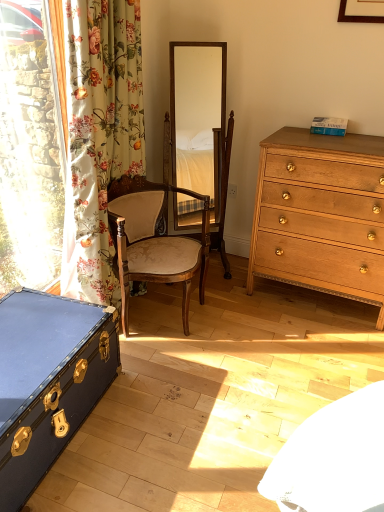
Question: Does wooden mirror at center appear on the right side of wooden chair at center?

Choices:
 (A) no
 (B) yes

Answer: (B)

Question: Does wooden mirror at center have a smaller size compared to wooden chair at center?

Choices:
 (A) no
 (B) yes

Answer: (B)

Question: Does wooden mirror at center come behind wooden chair at center?

Choices:
 (A) no
 (B) yes

Answer: (B)

Question: From the image's perspective, is wooden mirror at center located above wooden chair at center?

Choices:
 (A) no
 (B) yes

Answer: (B)

Question: Can you confirm if wooden mirror at center is positioned to the left of wooden chair at center?

Choices:
 (A) yes
 (B) no

Answer: (B)

Question: From the image's perspective, is light brown wood chest of drawers at right above or below wooden chair at center?

Choices:
 (A) below
 (B) above

Answer: (B)

Question: Does point (364, 250) appear closer or farther from the camera than point (206, 254)?

Choices:
 (A) farther
 (B) closer

Answer: (B)

Question: From a real-world perspective, relative to wooden chair at center, is light brown wood chest of drawers at right vertically above or below?

Choices:
 (A) below
 (B) above

Answer: (B)

Question: Would you say light brown wood chest of drawers at right is to the left or to the right of wooden chair at center in the picture?

Choices:
 (A) right
 (B) left

Answer: (A)

Question: Considering the relative positions of white plastic power outlet at center and blue leather trunk at lower left in the image provided, is white plastic power outlet at center to the left or to the right of blue leather trunk at lower left?

Choices:
 (A) left
 (B) right

Answer: (B)

Question: Is point coord(231,186) closer or farther from the camera than point coord(36,453)?

Choices:
 (A) closer
 (B) farther

Answer: (B)

Question: Based on their sizes in the image, would you say white plastic power outlet at center is bigger or smaller than blue leather trunk at lower left?

Choices:
 (A) big
 (B) small

Answer: (B)

Question: Is white plastic power outlet at center inside or outside of blue leather trunk at lower left?

Choices:
 (A) outside
 (B) inside

Answer: (A)

Question: Is floral fabric curtain at left in front of or behind light brown wood chest of drawers at right in the image?

Choices:
 (A) front
 (B) behind

Answer: (A)

Question: Is floral fabric curtain at left taller or shorter than light brown wood chest of drawers at right?

Choices:
 (A) short
 (B) tall

Answer: (B)